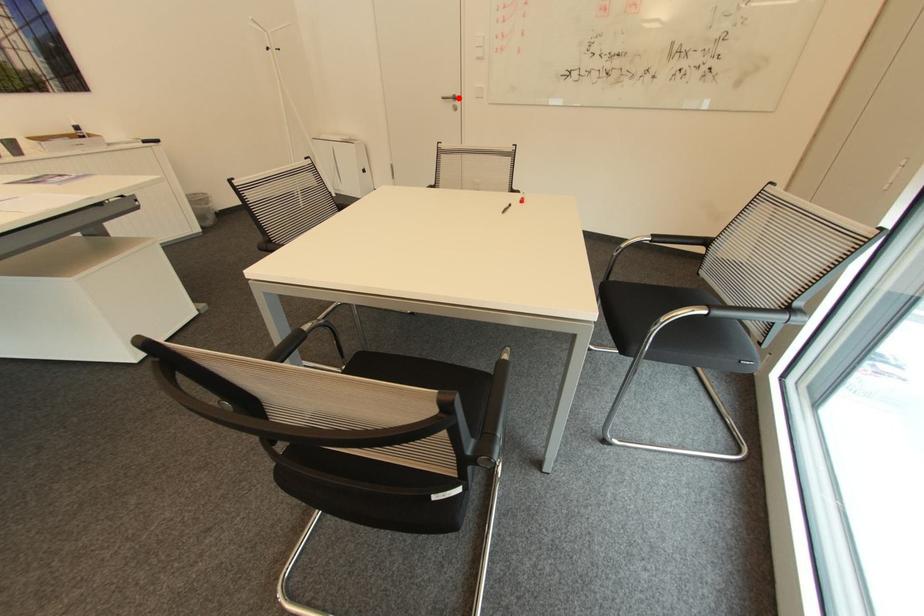
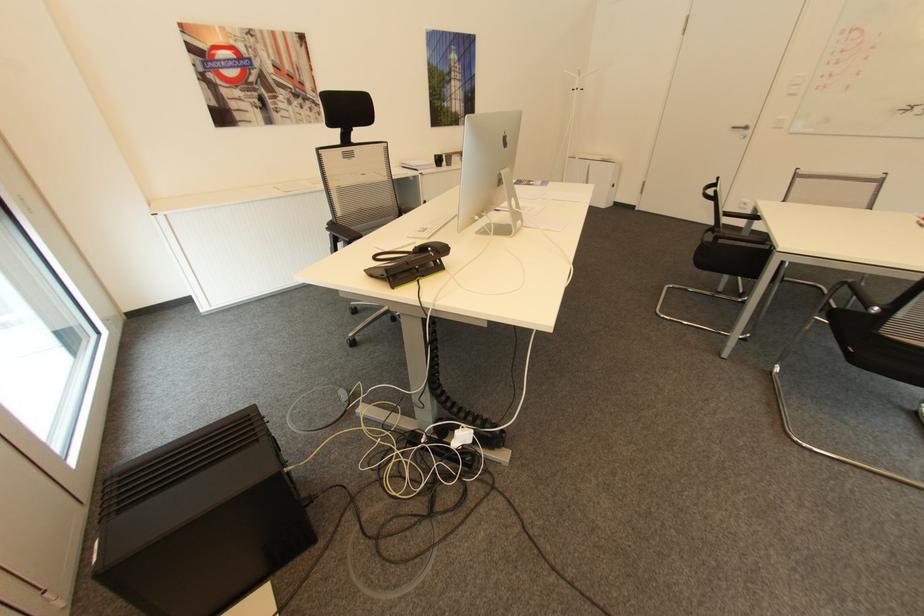
Where in the second image is the point corresponding to the highlighted location from the first image?

(749, 128)